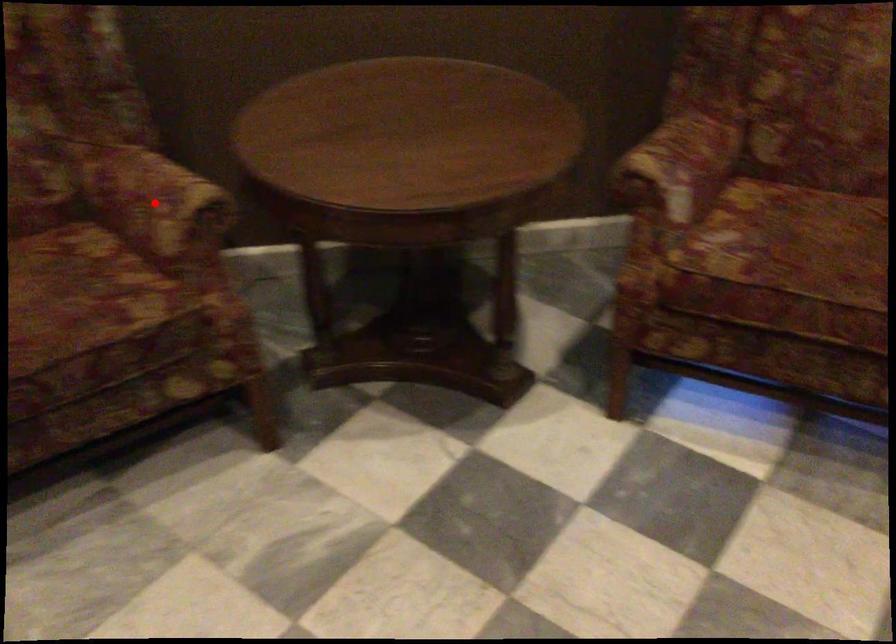
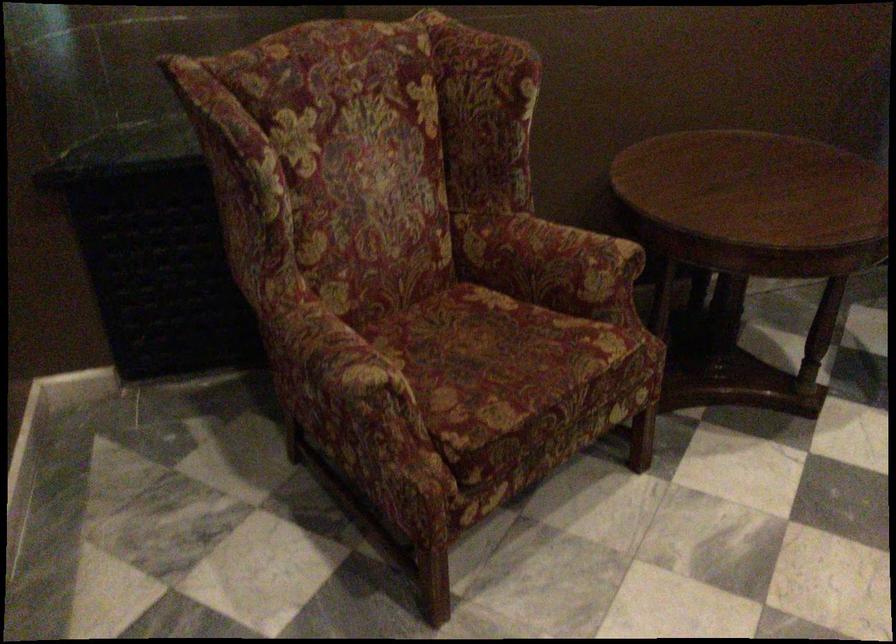
Question: I am providing you with two images of the same scene from different viewpoints. Given a red point in image1, look at the same physical point in image2. Is it:

Choices:
 (A) Closer to the viewpoint
 (B) Farther from the viewpoint

Answer: (B)